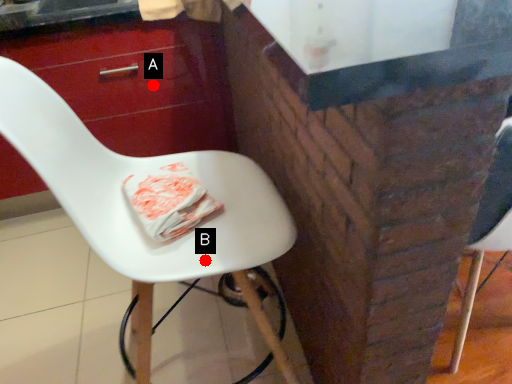
Question: Two points are circled on the image, labeled by A and B beside each circle. Among these points, which one is farthest from the camera?

Choices:
 (A) A is further
 (B) B is further

Answer: (A)